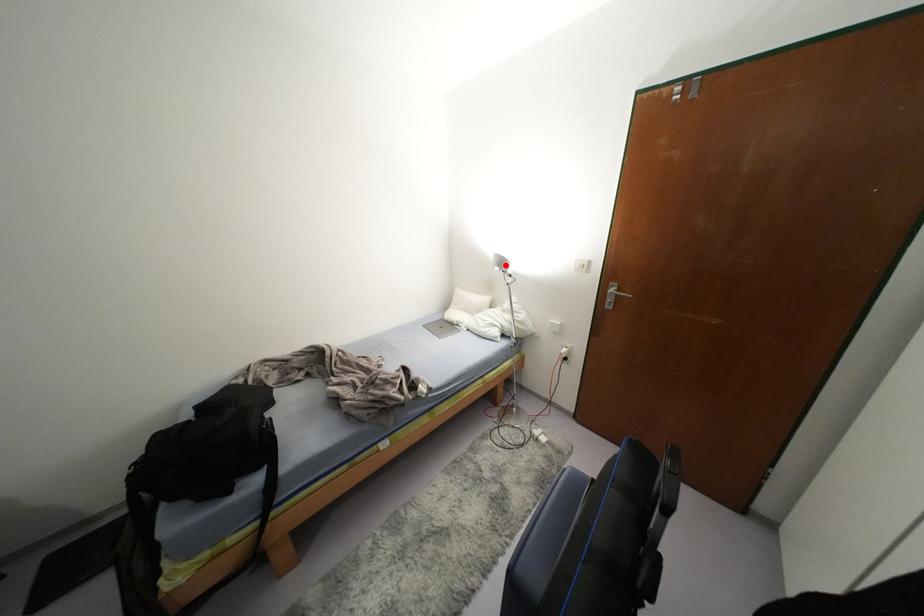
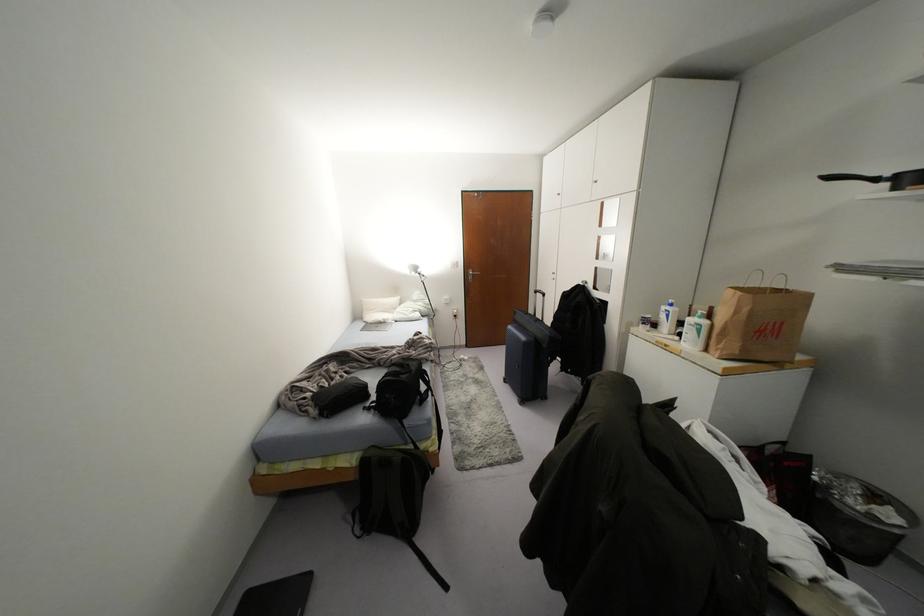
Locate, in the second image, the point that corresponds to the highlighted location in the first image.

(419, 270)